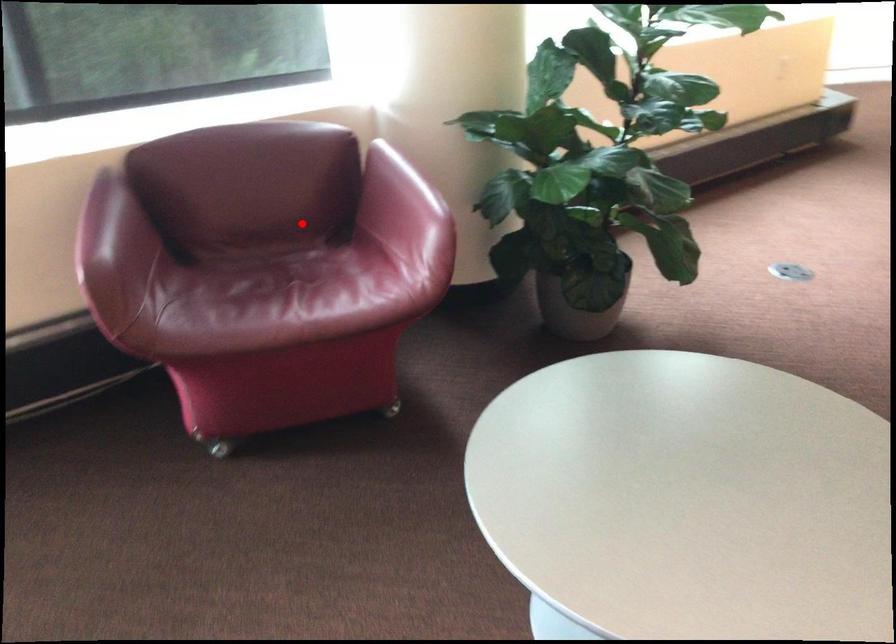
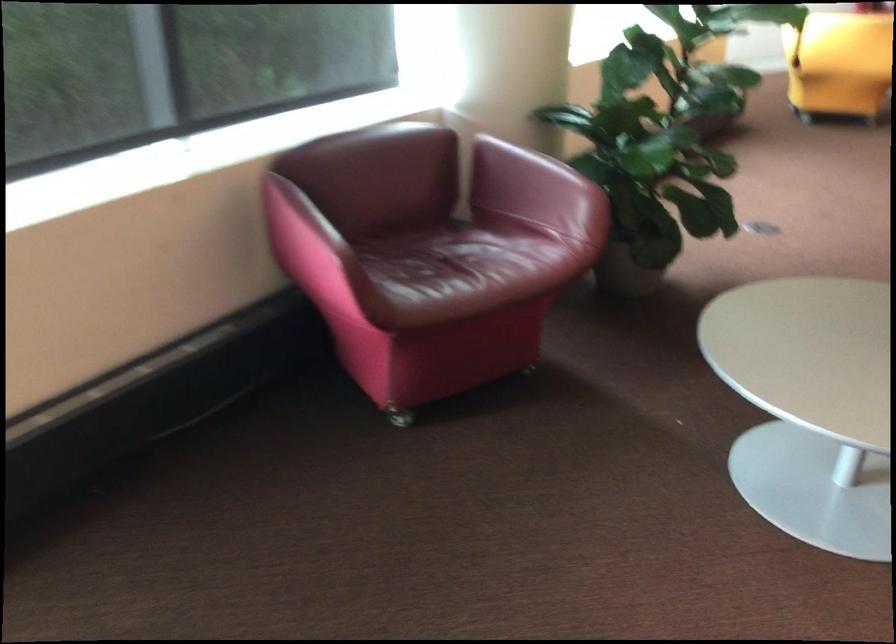
The point at the highlighted location is marked in the first image. Where is the corresponding point in the second image?

(426, 212)